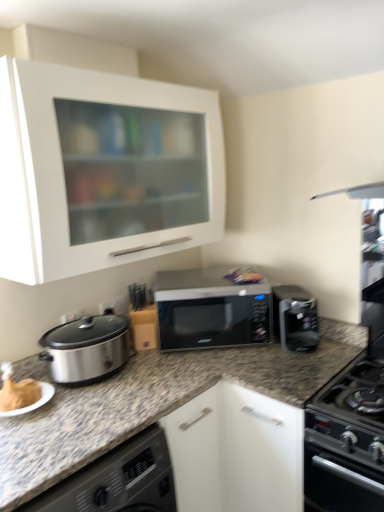
Question: Does point (258, 282) appear closer or farther from the camera than point (279, 339)?

Choices:
 (A) closer
 (B) farther

Answer: (B)

Question: From the image's perspective, is multicolored plastic bag at center positioned above or below satin black coffee maker at right?

Choices:
 (A) above
 (B) below

Answer: (A)

Question: Estimate the real-world distances between objects in this image. Which object is farther from the satin black coffee maker at right?

Choices:
 (A) sleek black microwave at center
 (B) black matte oven at lower right
 (C) multicolored plastic bag at center
 (D) white matte cabinet at upper left

Answer: (D)

Question: Which of these objects is positioned closest to the black matte oven at lower right?

Choices:
 (A) white matte cabinet at upper left
 (B) sleek black microwave at center
 (C) multicolored plastic bag at center
 (D) satin black coffee maker at right

Answer: (D)